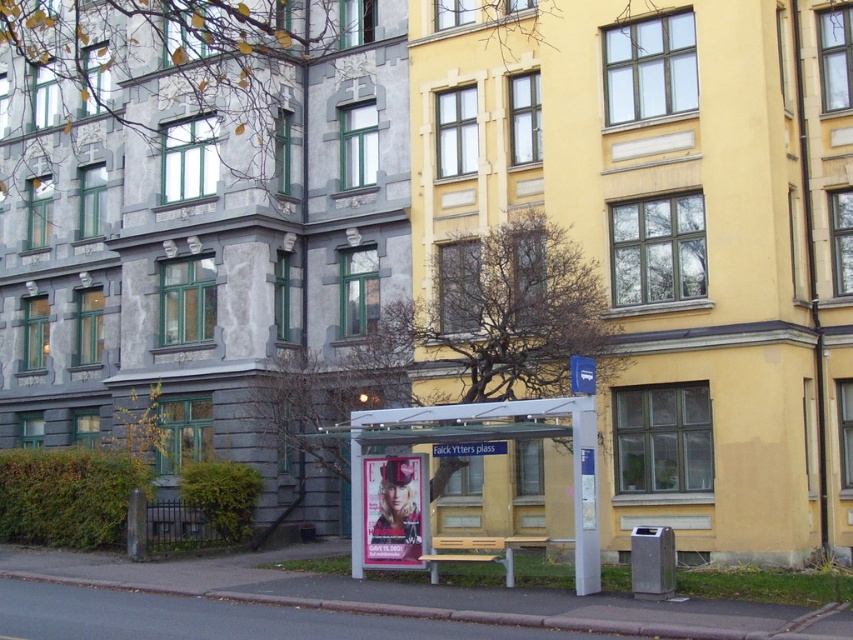
Can you confirm if matte plastic poster at center is smaller than blue plastic bus stop sign at center?

No, matte plastic poster at center is not smaller than blue plastic bus stop sign at center.

How distant is matte plastic poster at center from blue plastic bus stop sign at center?

3.21 meters

Which is behind, point (370, 520) or point (575, 368)?

The point (370, 520) is more distant.

Locate an element on the screen. Image resolution: width=853 pixels, height=640 pixels. matte plastic poster at center is located at coordinates (392, 512).

Where is `metallic silver bus stop at center`? This screenshot has width=853, height=640. metallic silver bus stop at center is located at coordinates (483, 440).

Who is more forward, (590,580) or (582,376)?

Point (590,580)

Image resolution: width=853 pixels, height=640 pixels. Identify the location of metallic silver bus stop at center. (483, 440).

Locate an element on the screen. The image size is (853, 640). metallic silver bus stop at center is located at coordinates click(483, 440).

Does point (442, 419) come farther from viewer compared to point (402, 516)?

That is False.

At what (x,y) coordinates should I click in order to perform the action: click on metallic silver bus stop at center. Please return your answer as a coordinate pair (x, y). The image size is (853, 640). Looking at the image, I should click on (483, 440).